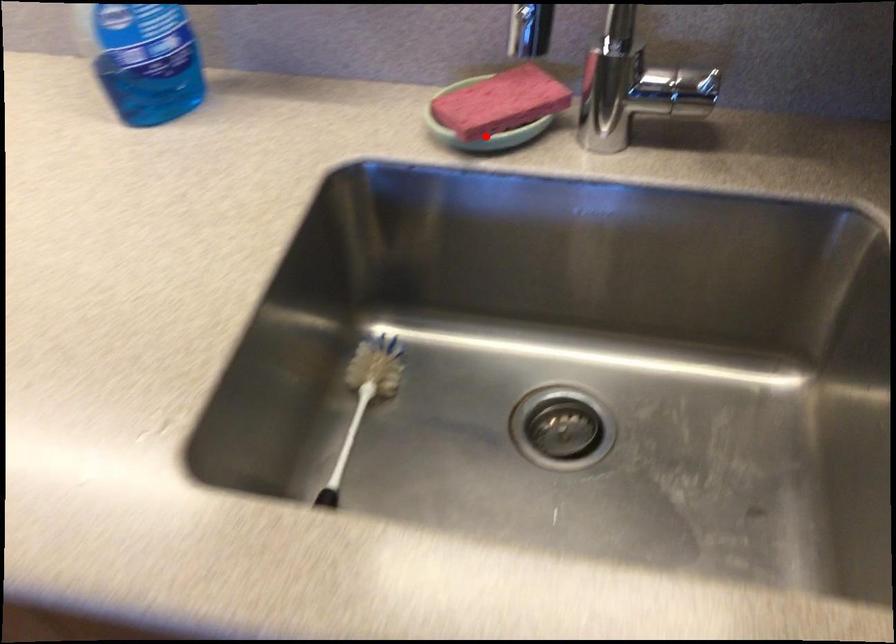
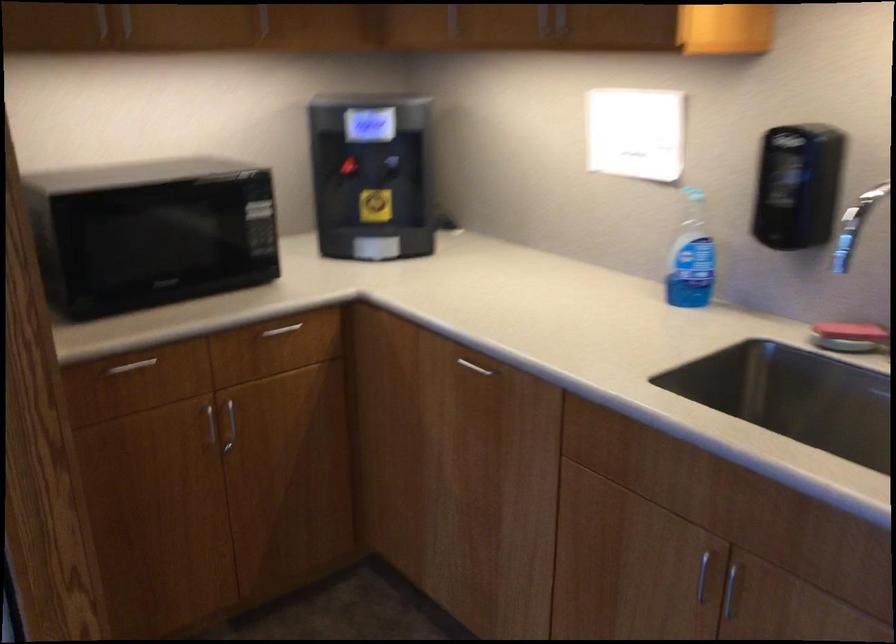
In the second image, find the point that corresponds to the highlighted location in the first image.

(848, 337)